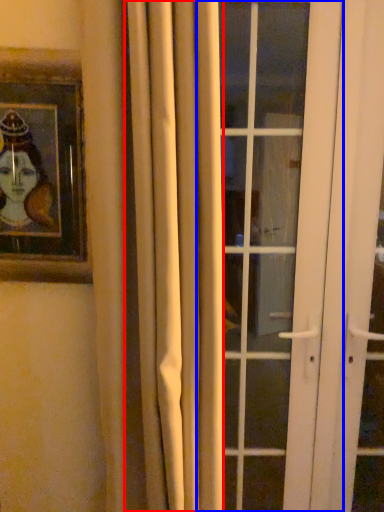
Question: Among these objects, which one is nearest to the camera, curtain (highlighted by a red box) or door (highlighted by a blue box)?

Choices:
 (A) curtain
 (B) door

Answer: (A)